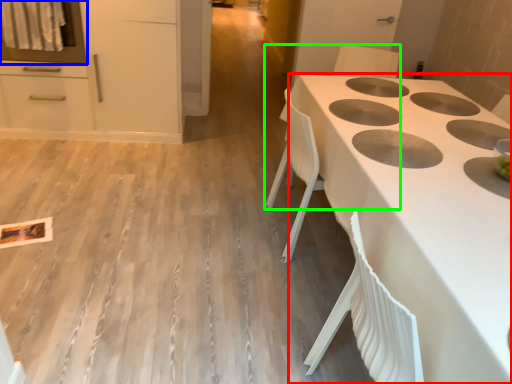
Question: Which is nearer to the countertop (highlighted by a red box)? oven (highlighted by a blue box) or chair (highlighted by a green box).

Choices:
 (A) oven
 (B) chair

Answer: (B)